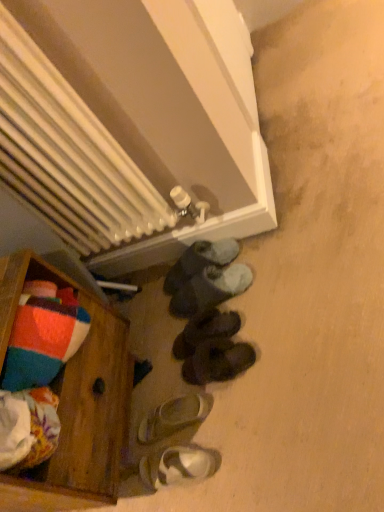
Question: Which direction should I rotate to look at dark gray suede slippers at lower center, the second footwear positioned from the top, — up or down?

Choices:
 (A) down
 (B) up

Answer: (A)

Question: Considering the relative sizes of dark gray suede slippers at lower center, which is the 5th footwear from bottom to top, and white matte sandal at lower center, which is the fifth footwear from top to bottom, in the image provided, is dark gray suede slippers at lower center, which is the 5th footwear from bottom to top, bigger than white matte sandal at lower center, which is the fifth footwear from top to bottom,?

Choices:
 (A) no
 (B) yes

Answer: (B)

Question: Does dark gray suede slippers at lower center, which is the 5th footwear from bottom to top, have a greater width compared to white matte sandal at lower center, which is the fifth footwear from top to bottom?

Choices:
 (A) no
 (B) yes

Answer: (B)

Question: Considering the relative positions of dark gray suede slippers at lower center, which is the 5th footwear from bottom to top, and white matte sandal at lower center, which ranks as the 2th footwear in bottom-to-top order, in the image provided, is dark gray suede slippers at lower center, which is the 5th footwear from bottom to top, to the left of white matte sandal at lower center, which ranks as the 2th footwear in bottom-to-top order, from the viewer's perspective?

Choices:
 (A) no
 (B) yes

Answer: (A)

Question: Does dark gray suede slippers at lower center, the second footwear positioned from the top, turn towards white matte sandal at lower center, which is the fifth footwear from top to bottom?

Choices:
 (A) yes
 (B) no

Answer: (B)

Question: Does dark gray suede slippers at lower center, the second footwear positioned from the top, have a greater height compared to white matte sandal at lower center, which ranks as the 2th footwear in bottom-to-top order?

Choices:
 (A) no
 (B) yes

Answer: (B)

Question: Is there a large distance between dark gray suede slippers at lower center, which is the 5th footwear from bottom to top, and white matte sandal at lower center, which is the fifth footwear from top to bottom?

Choices:
 (A) yes
 (B) no

Answer: (B)

Question: Does black suede slippers at center, which is counted as the third footwear, starting from the top, appear on the right side of white metallic radiator at upper center?

Choices:
 (A) yes
 (B) no

Answer: (A)

Question: Considering the relative positions of black suede slippers at center, which appears as the 4th footwear when ordered from the bottom, and white metallic radiator at upper center in the image provided, is black suede slippers at center, which appears as the 4th footwear when ordered from the bottom, behind white metallic radiator at upper center?

Choices:
 (A) no
 (B) yes

Answer: (B)

Question: Is black suede slippers at center, which is counted as the third footwear, starting from the top, outside white metallic radiator at upper center?

Choices:
 (A) no
 (B) yes

Answer: (B)

Question: Is the position of black suede slippers at center, which is counted as the third footwear, starting from the top, less distant than that of white metallic radiator at upper center?

Choices:
 (A) yes
 (B) no

Answer: (B)

Question: Can you confirm if black suede slippers at center, which is counted as the third footwear, starting from the top, is smaller than white metallic radiator at upper center?

Choices:
 (A) yes
 (B) no

Answer: (A)

Question: Is black suede slippers at center, which appears as the 4th footwear when ordered from the bottom, at the left side of white metallic radiator at upper center?

Choices:
 (A) no
 (B) yes

Answer: (A)

Question: Can you confirm if white metallic radiator at upper center is positioned to the left of white matte sandals at lower center, arranged as the 1th footwear when ordered from the bottom?

Choices:
 (A) no
 (B) yes

Answer: (B)